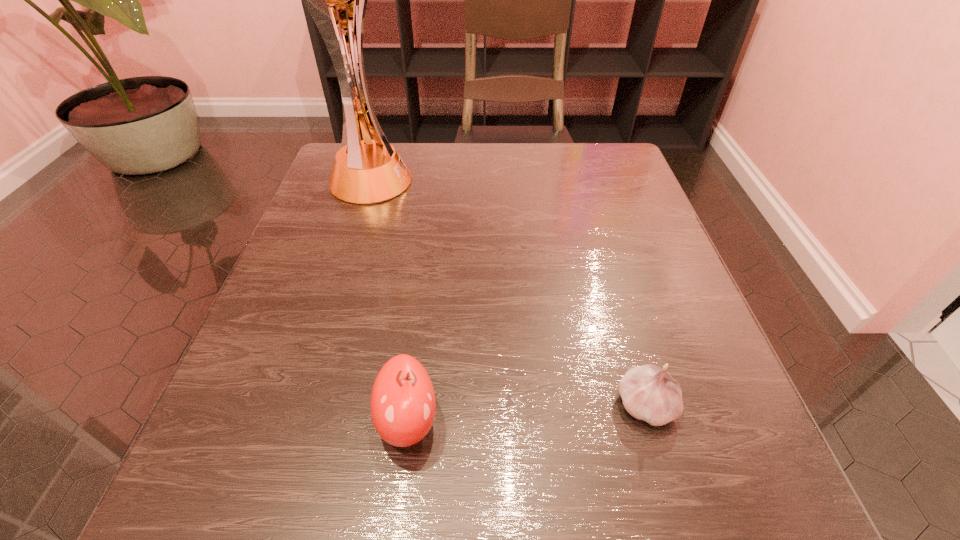
The image size is (960, 540). Find the location of `vacant region between the rightmost object and the tallest object`. vacant region between the rightmost object and the tallest object is located at coordinates (507, 294).

This screenshot has width=960, height=540. Identify the location of vacant area between the second object from right to left and the tallest object. (388, 301).

The width and height of the screenshot is (960, 540). In order to click on unoccupied area between the rightmost object and the second object from left to right in this screenshot , I will do 526,413.

What are the coordinates of `free spot between the leftmost object and the garlic` in the screenshot? It's located at (507, 294).

The image size is (960, 540). In order to click on free space between the leftmost object and the rightmost object in this screenshot , I will do `click(507, 294)`.

The height and width of the screenshot is (540, 960). Identify the location of free space between the rightmost object and the second object from left to right. (526, 413).

Identify the location of vacant space that's between the leftmost object and the rightmost object. This screenshot has height=540, width=960. (507, 294).

Locate an element on the screen. This screenshot has height=540, width=960. object that stands as the second closest to the rightmost object is located at coordinates (370, 171).

You are a GUI agent. You are given a task and a screenshot of the screen. Output one action in this format:
    pyautogui.click(x=<x>, y=<y>)
    Task: Click on the object that is the second closest to the rightmost object
    
    Given the screenshot: What is the action you would take?
    pyautogui.click(x=370, y=171)

Locate an element on the screen. This screenshot has height=540, width=960. vacant region that satisfies the following two spatial constraints: 1. on the back side of the rightmost object; 2. on the front-facing side of the leftmost object is located at coordinates (581, 182).